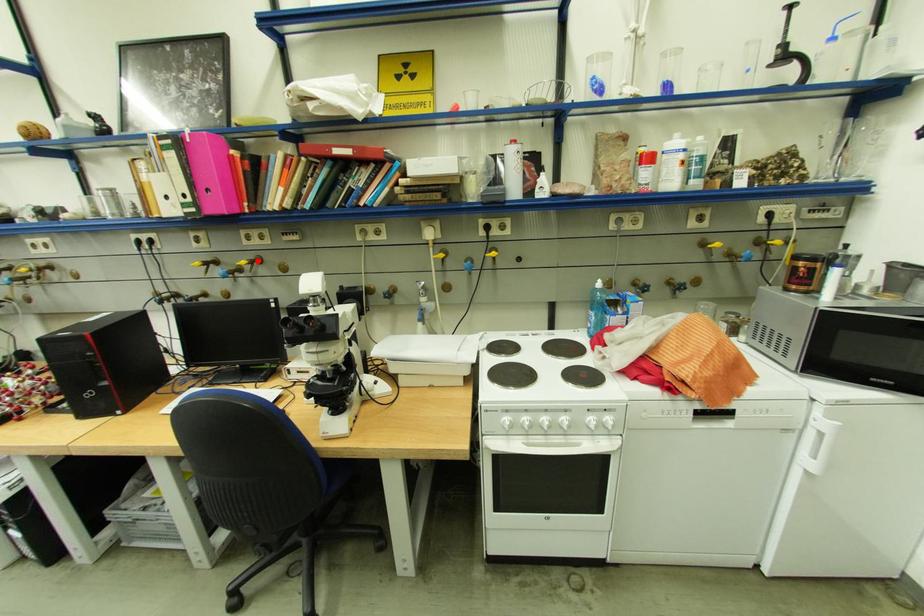
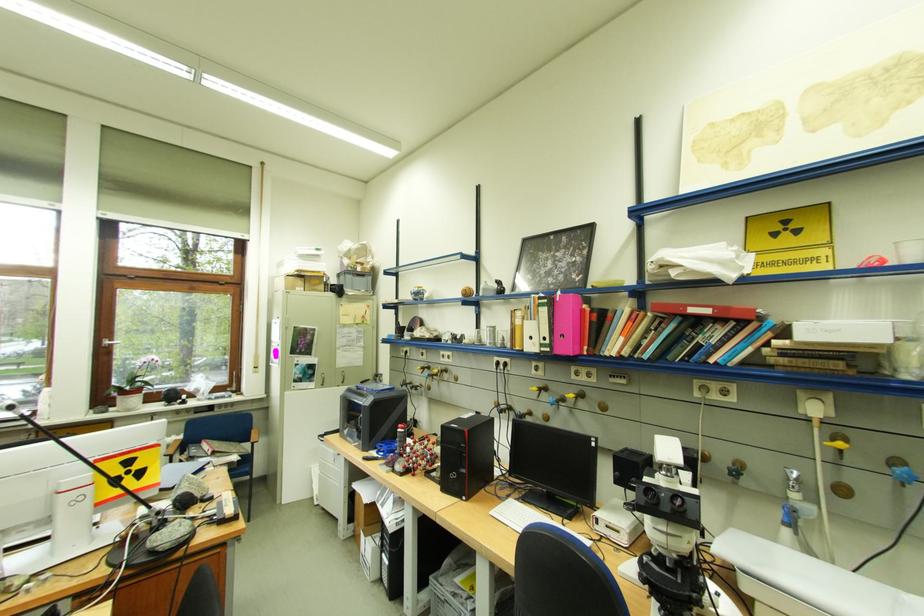
The point at the highlighted location is marked in the first image. Where is the corresponding point in the second image?

(585, 395)